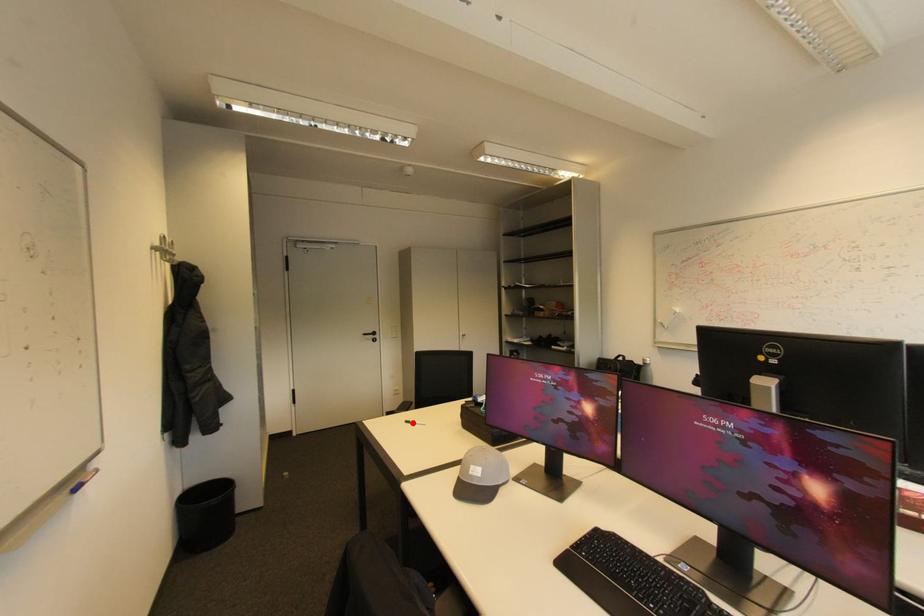
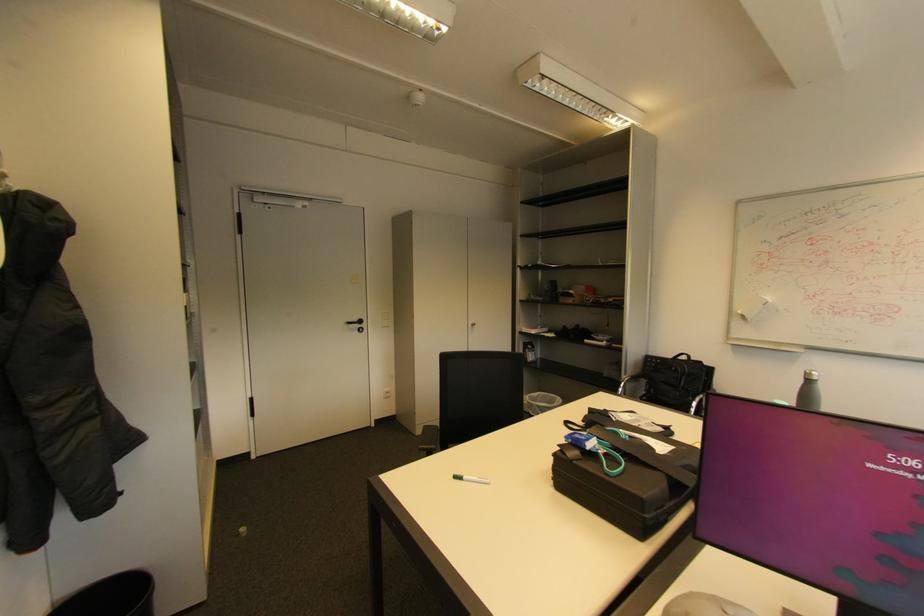
Question: I am providing you with two images of the same scene from different viewpoints. In image1, a red point is highlighted. Considering the same 3D point in image2, which of the following is correct?

Choices:
 (A) It is closer
 (B) It is farther

Answer: (A)